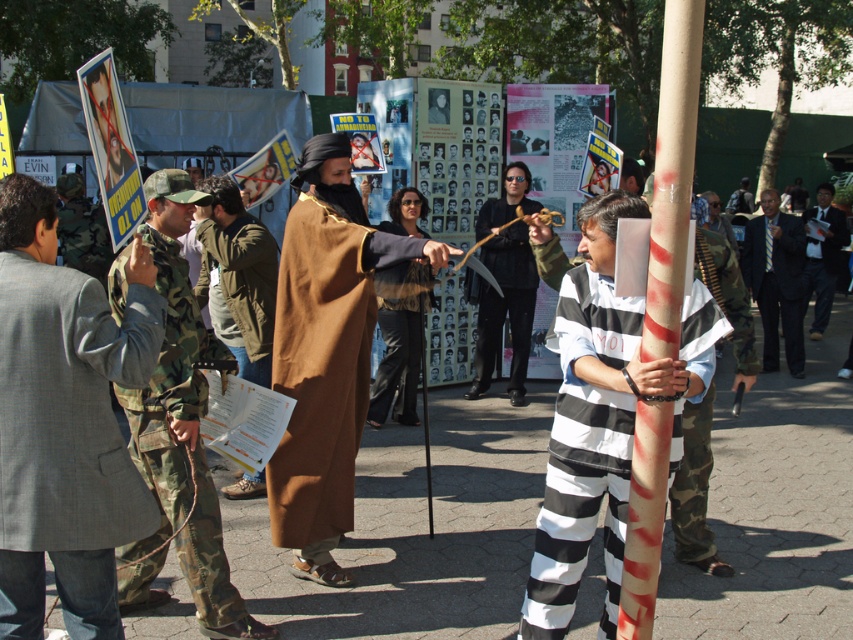
Which is behind, point (485, 342) or point (828, 232)?

Point (828, 232)

Can you confirm if black matte scythe at center is taller than dark suit at right?

Correct, black matte scythe at center is much taller as dark suit at right.

Where is `black matte scythe at center`? black matte scythe at center is located at coordinates (505, 284).

You are a GUI agent. You are given a task and a screenshot of the screen. Output one action in this format:
    pyautogui.click(x=<x>, y=<y>)
    Task: Click on the black matte scythe at center
    This screenshot has height=640, width=853.
    Given the screenshot: What is the action you would take?
    pyautogui.click(x=505, y=284)

Between striped cotton shirt at center and brown cotton robe at center, which one has less height?

striped cotton shirt at center is shorter.

Between point (618, 372) and point (280, 444), which one is positioned behind?

The point (280, 444) is more distant.

This screenshot has height=640, width=853. Find the location of `striped cotton shirt at center`. striped cotton shirt at center is located at coordinates (602, 417).

Is brown cotton robe at center thinner than dark suit at right?

Correct, brown cotton robe at center's width is less than dark suit at right's.

Is point (283, 502) behind point (807, 272)?

No, (283, 502) is in front of (807, 272).

I want to click on brown cotton robe at center, so click(323, 365).